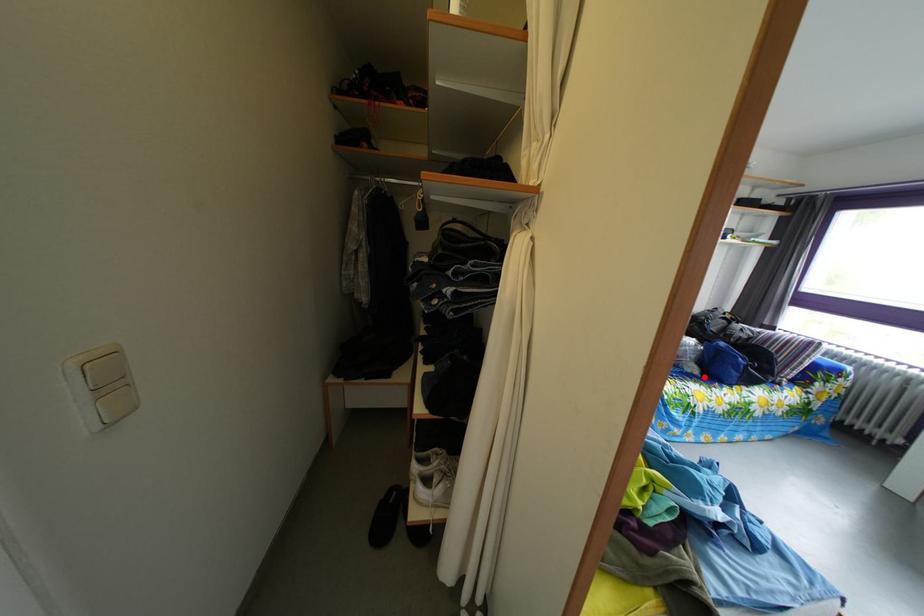
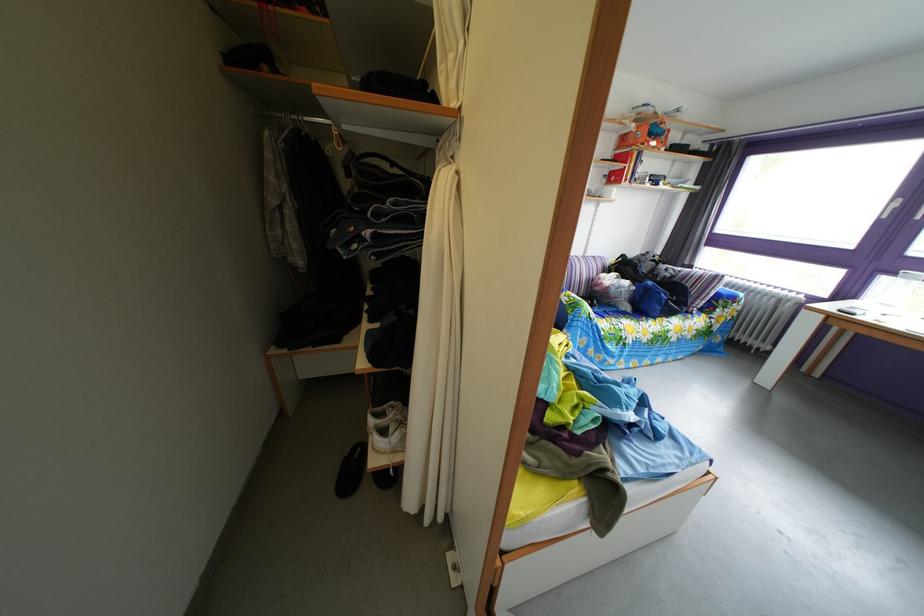
Question: I am providing you with two images of the same scene from different viewpoints. A red point is marked on the first image. Is the red point's position out of view in image 2?

Choices:
 (A) Yes
 (B) No

Answer: (B)